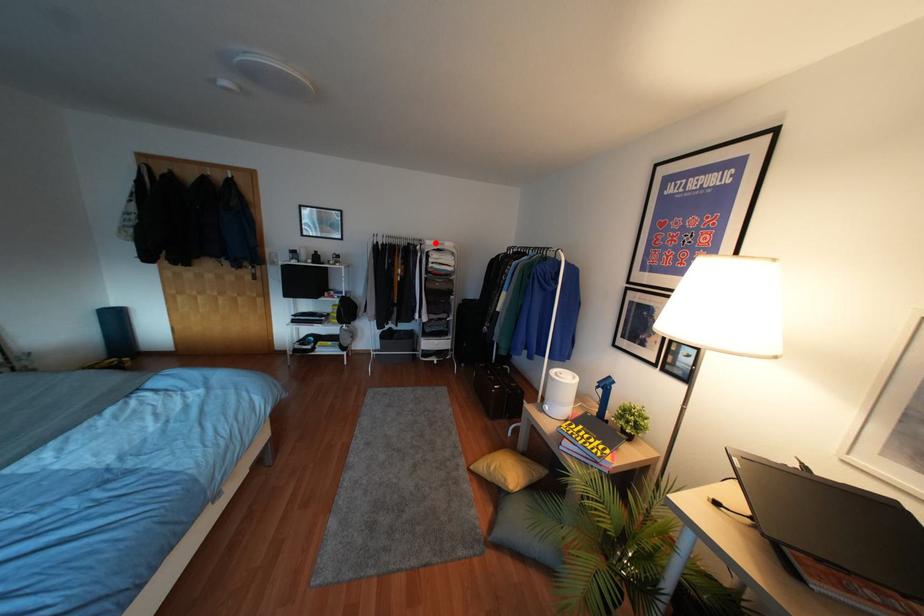
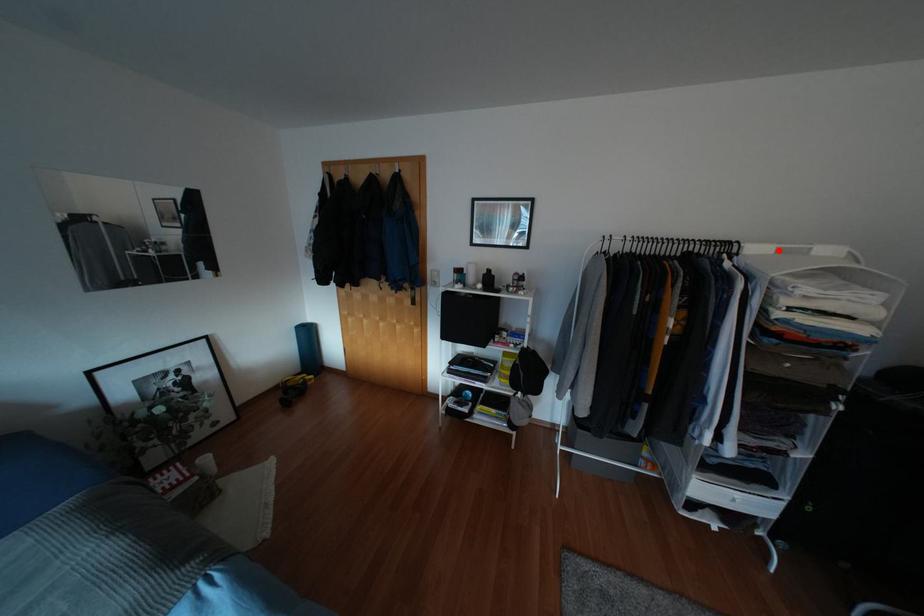
I am providing you with two images of the same scene from different viewpoints. A red point is marked on the first image and another point is marked on the second image. Does the point marked in image1 correspond to the same location as the one in image2?

Yes